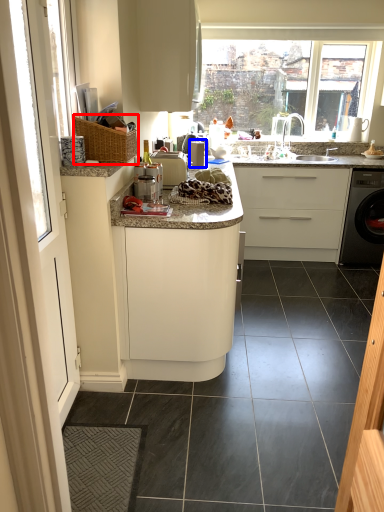
Question: Which point is further to the camera, basket (highlighted by a red box) or appliance (highlighted by a blue box)?

Choices:
 (A) basket
 (B) appliance

Answer: (B)